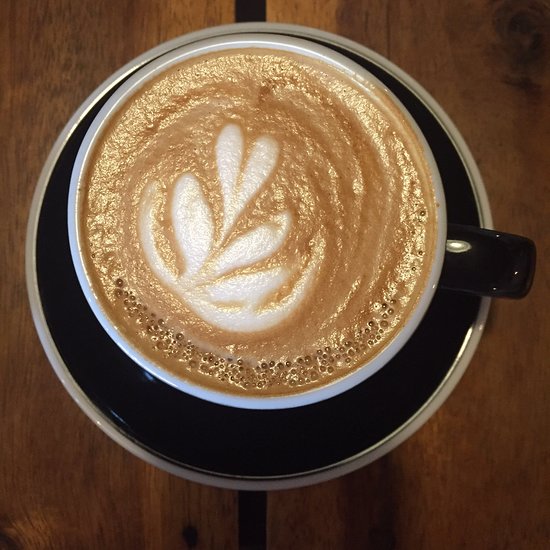
Find the location of a particular element. The image size is (550, 550). mug is located at coordinates (266, 412).